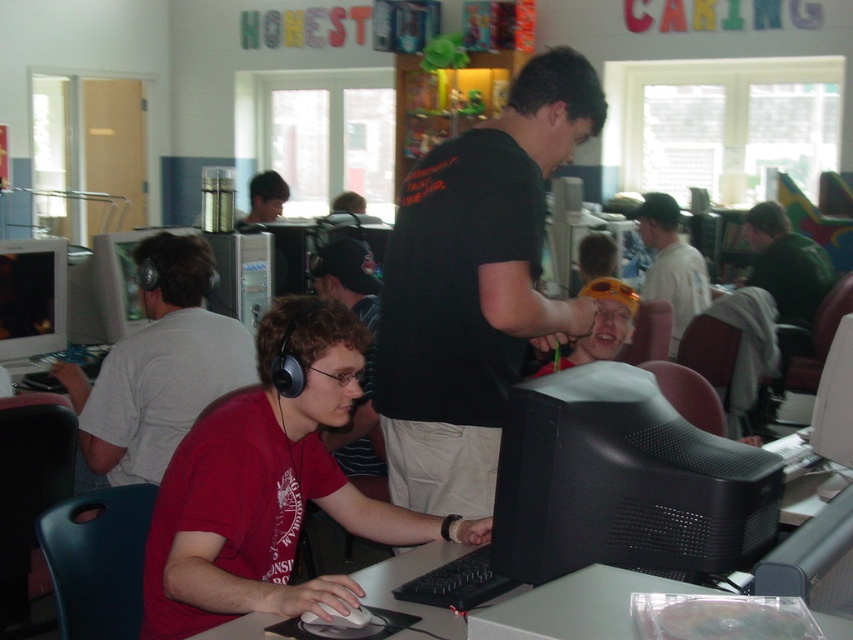
You are a visitor in the computer lab and want to sit at the white plastic table at lower center. However, there is a person in a matte red shirt at center who is currently using the table. Can you estimate if there is enough space for you to sit down without disturbing them?

The matte red shirt at center is much taller than the white plastic table at lower center. Since the person is taller than the table, they are likely seated at it, leaving little to no space for you to sit without disturbing them.